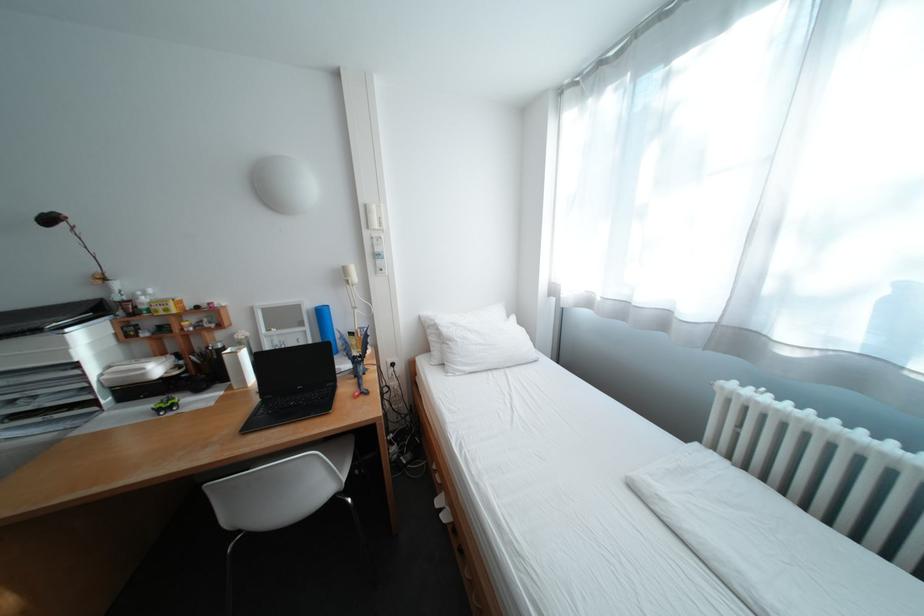
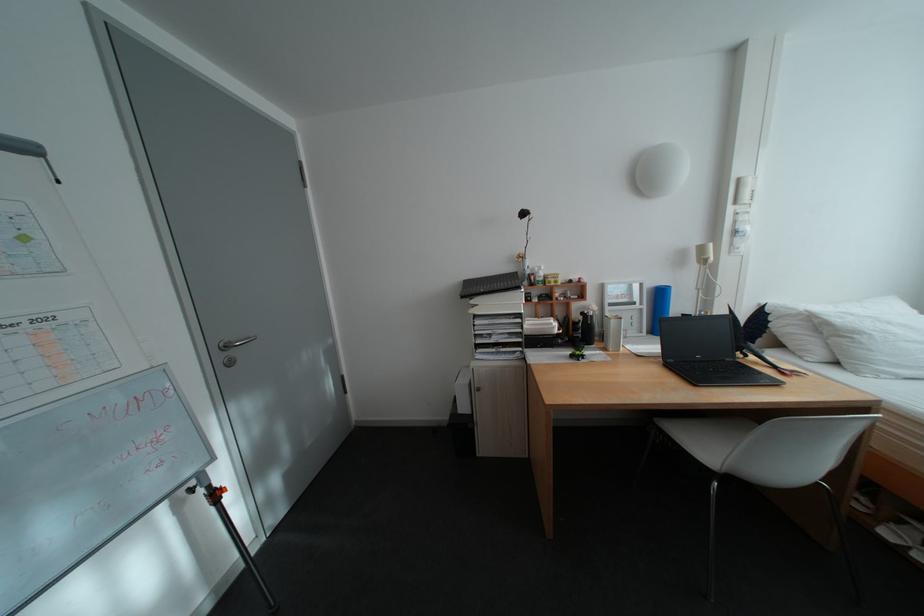
Where in the second image is the point corresponding to (x=465, y=342) from the first image?

(871, 334)